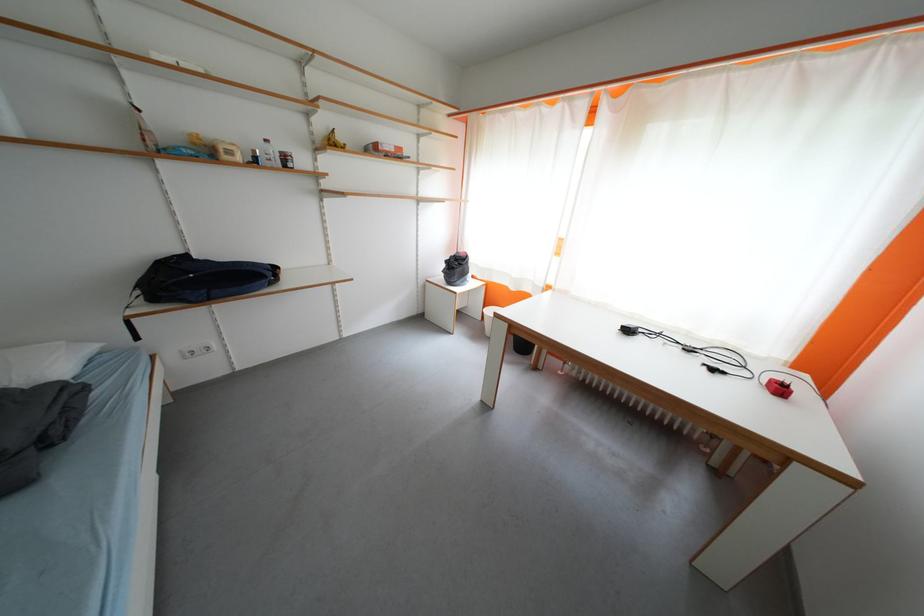
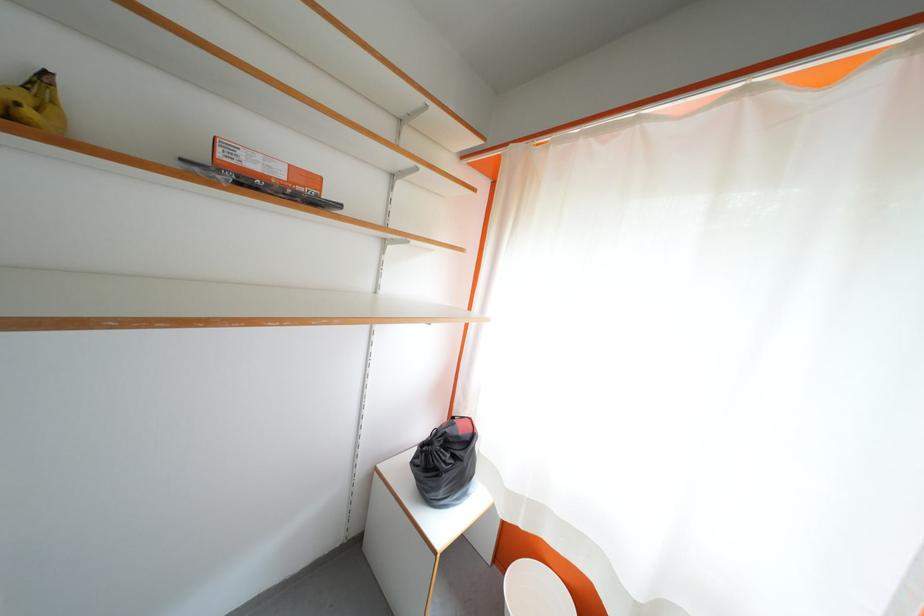
Locate, in the second image, the point that corresponds to the point at 465,270 in the first image.

(455, 460)